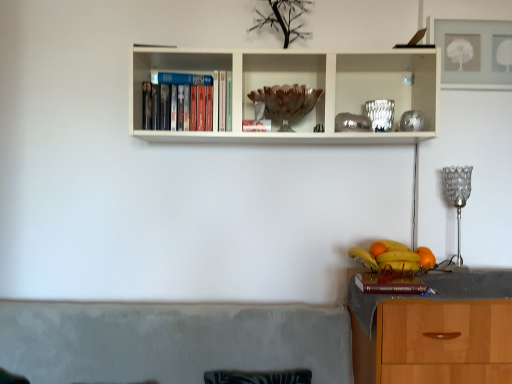
Where is `free space above yellow matte bananas at lower right (from a real-world perspective)`? The image size is (512, 384). free space above yellow matte bananas at lower right (from a real-world perspective) is located at coordinates (384, 255).